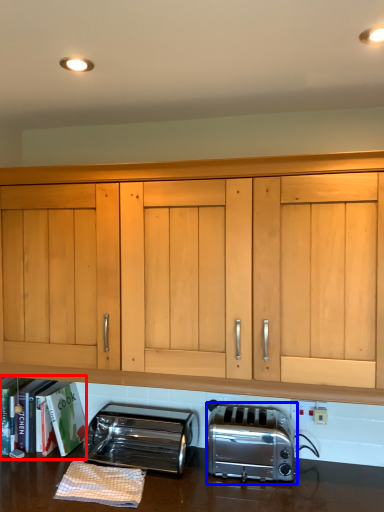
Question: Which object is closer to the camera taking this photo, bookshelf (highlighted by a red box) or toaster (highlighted by a blue box)?

Choices:
 (A) bookshelf
 (B) toaster

Answer: (B)